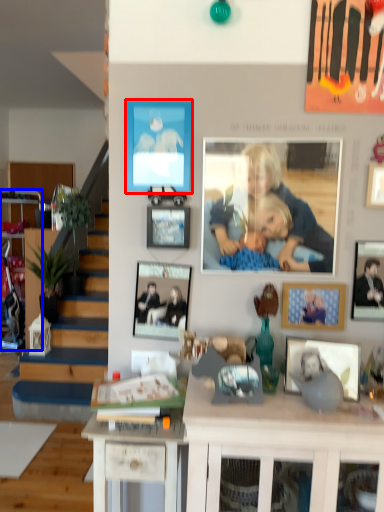
Question: Which point is further to the camera, picture frame (highlighted by a red box) or cabinetry (highlighted by a blue box)?

Choices:
 (A) picture frame
 (B) cabinetry

Answer: (B)